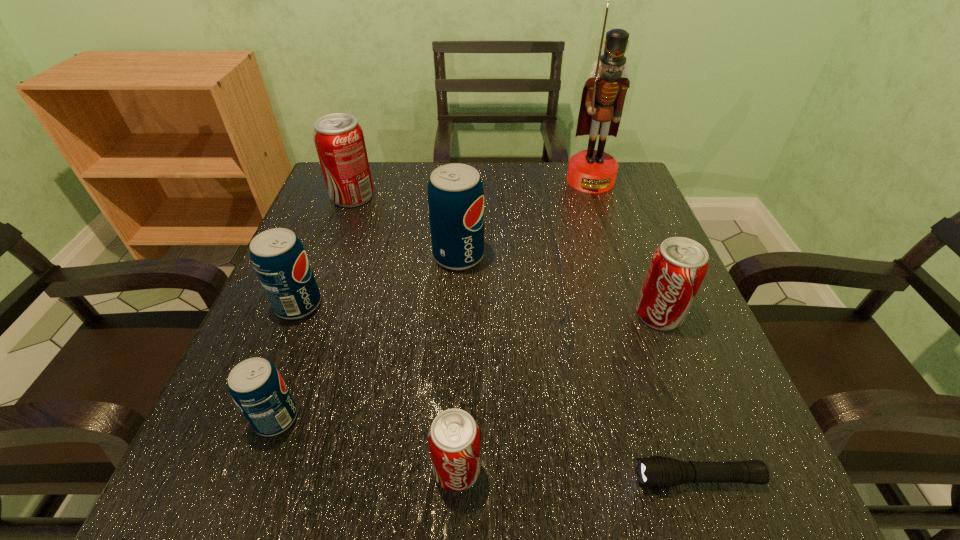
I want to click on nutcracker, so click(x=593, y=171).

Locate an element on the screen. the tallest object is located at coordinates 593,171.

This screenshot has width=960, height=540. What are the coordinates of `the rightmost blue pop` in the screenshot? It's located at coord(455,191).

The image size is (960, 540). What are the coordinates of `the biggest blue pop` in the screenshot? It's located at (455, 191).

Locate an element on the screen. This screenshot has height=540, width=960. the biggest red soda can is located at coordinates (339, 140).

Where is `the farthest soda can`? This screenshot has width=960, height=540. the farthest soda can is located at coordinates (339, 140).

Find the location of a particular element. The image size is (960, 540). the second nearest blue pop is located at coordinates (279, 259).

Find the location of a particular element. The image size is (960, 540). the rightmost soda can is located at coordinates (678, 266).

Find the location of a particular element. The width and height of the screenshot is (960, 540). the rightmost red soda can is located at coordinates (678, 266).

Identify the location of the nearest blue pop. This screenshot has height=540, width=960. (255, 385).